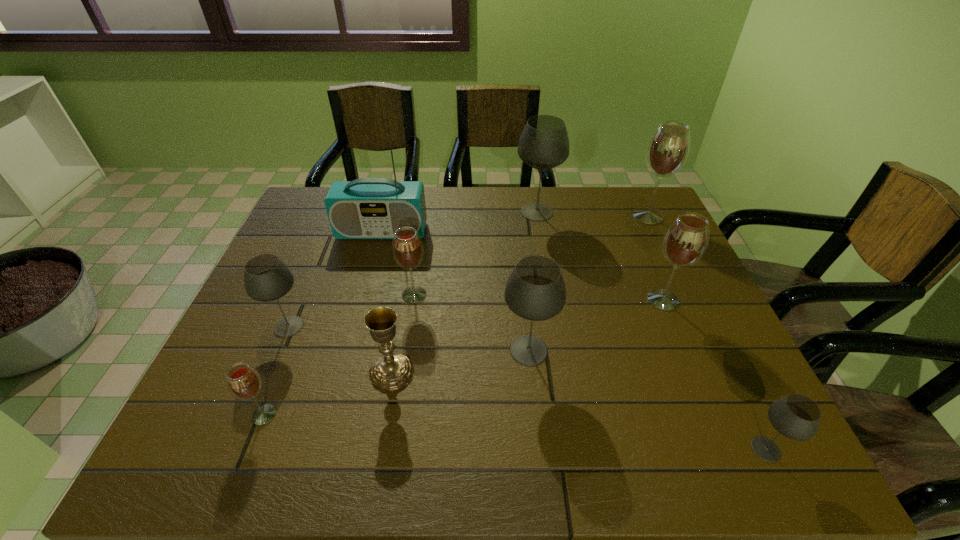
Locate an element on the screen. The image size is (960, 540). vacant area situated on the back of the third biggest gray wineglass is located at coordinates coord(315,262).

Image resolution: width=960 pixels, height=540 pixels. What are the coordinates of `vacant space located 0.380m on the back of the chalice` in the screenshot? It's located at (413, 250).

The image size is (960, 540). I want to click on vacant space located on the left of the leftmost red wineglass, so click(x=197, y=415).

Identify the location of free point located on the left of the smallest gray wineglass. (623, 449).

Where is `radio receiver located in the far edge section of the desktop`? This screenshot has height=540, width=960. radio receiver located in the far edge section of the desktop is located at coordinates click(366, 208).

At what (x,y) coordinates should I click in order to perform the action: click on radio receiver that is at the left edge. Please return your answer as a coordinate pair (x, y). The image size is (960, 540). Looking at the image, I should click on (366, 208).

Where is `object situated at the far left corner`? This screenshot has height=540, width=960. object situated at the far left corner is located at coordinates (366, 208).

Locate an element on the screen. Image resolution: width=960 pixels, height=540 pixels. object at the near left corner is located at coordinates (244, 383).

At what (x,y) coordinates should I click in order to perform the action: click on object located in the far right corner section of the desktop. Please return your answer as a coordinate pair (x, y). This screenshot has width=960, height=540. Looking at the image, I should click on (668, 149).

At what (x,y) coordinates should I click in order to perform the action: click on object present at the near right corner. Please return your answer as a coordinate pair (x, y). This screenshot has height=540, width=960. Looking at the image, I should click on (795, 416).